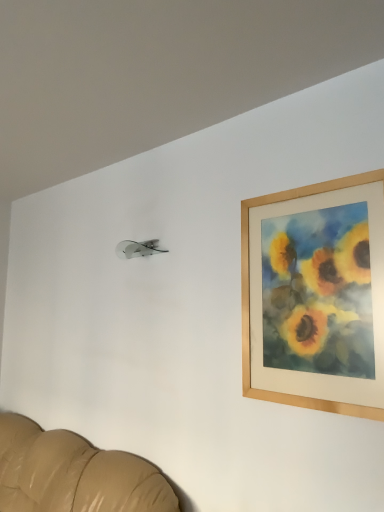
Question: From a real-world perspective, is wooden picture frame at upper right over leather couch at lower left?

Choices:
 (A) no
 (B) yes

Answer: (B)

Question: Is wooden picture frame at upper right positioned before leather couch at lower left?

Choices:
 (A) yes
 (B) no

Answer: (B)

Question: Is wooden picture frame at upper right directly adjacent to leather couch at lower left?

Choices:
 (A) no
 (B) yes

Answer: (A)

Question: Considering the relative sizes of wooden picture frame at upper right and leather couch at lower left in the image provided, is wooden picture frame at upper right bigger than leather couch at lower left?

Choices:
 (A) yes
 (B) no

Answer: (B)

Question: Is wooden picture frame at upper right smaller than leather couch at lower left?

Choices:
 (A) no
 (B) yes

Answer: (B)

Question: Is wooden picture frame at upper right at the left side of leather couch at lower left?

Choices:
 (A) yes
 (B) no

Answer: (B)

Question: Are leather couch at lower left and wooden picture frame at upper right beside each other?

Choices:
 (A) no
 (B) yes

Answer: (A)

Question: Considering the relative sizes of leather couch at lower left and wooden picture frame at upper right in the image provided, is leather couch at lower left wider than wooden picture frame at upper right?

Choices:
 (A) no
 (B) yes

Answer: (B)

Question: Considering the relative positions of leather couch at lower left and wooden picture frame at upper right in the image provided, is leather couch at lower left to the left of wooden picture frame at upper right from the viewer's perspective?

Choices:
 (A) yes
 (B) no

Answer: (A)

Question: Can you confirm if leather couch at lower left is positioned to the right of wooden picture frame at upper right?

Choices:
 (A) yes
 (B) no

Answer: (B)

Question: Is leather couch at lower left far away from wooden picture frame at upper right?

Choices:
 (A) yes
 (B) no

Answer: (A)

Question: From the image's perspective, is leather couch at lower left beneath wooden picture frame at upper right?

Choices:
 (A) no
 (B) yes

Answer: (B)

Question: In terms of height, does wooden picture frame at upper right look taller or shorter compared to leather couch at lower left?

Choices:
 (A) tall
 (B) short

Answer: (A)